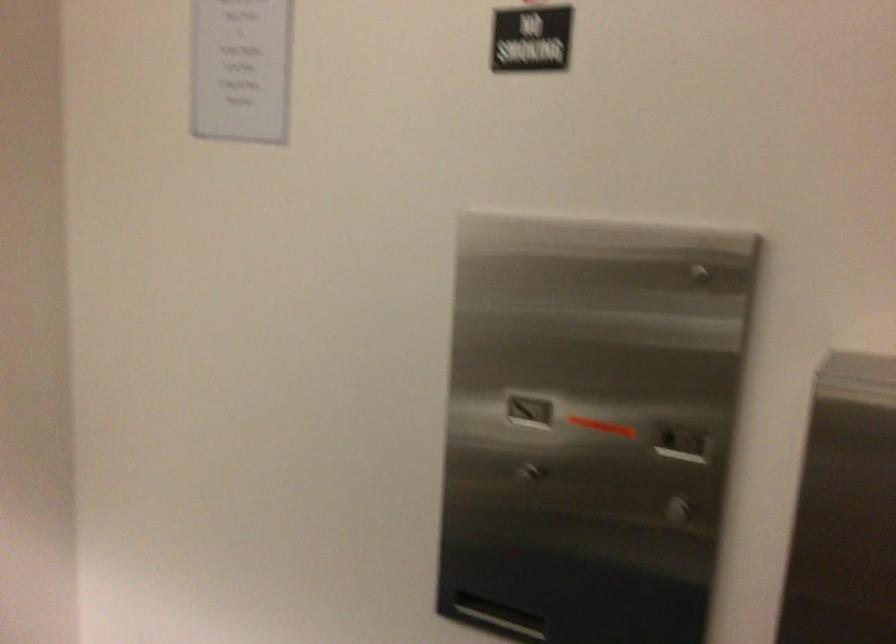
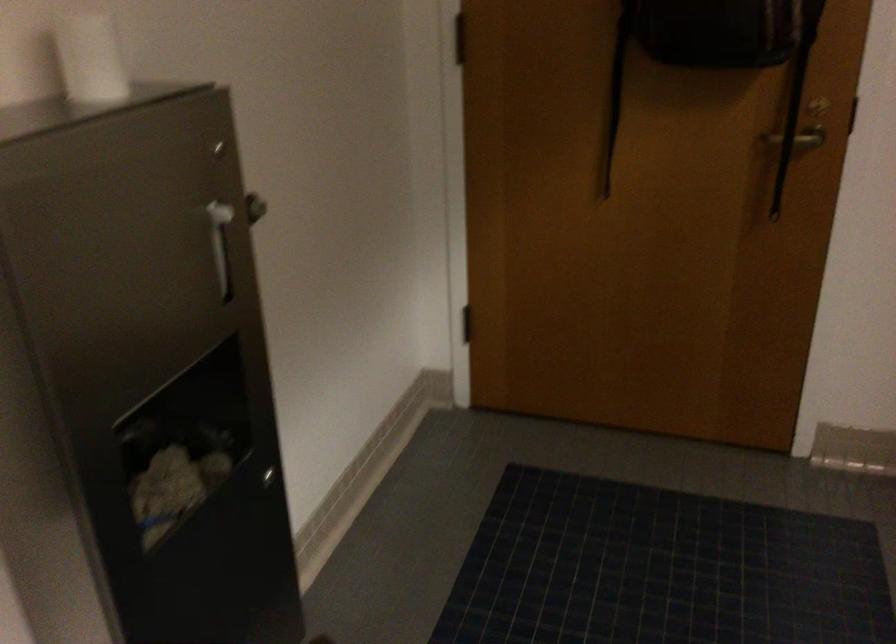
The images are taken continuously from a first-person perspective. In which direction is your viewpoint rotating?

The camera rotated toward right-down.